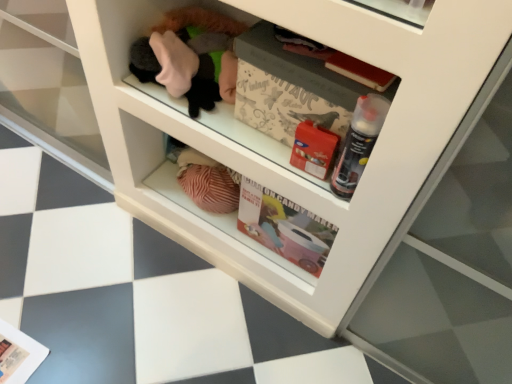
In order to face translucent plastic spray can at center right, should I rotate leftwards or rightwards?

A 13.614 degree turn to the right will do.

What do you see at coordinates (291, 88) in the screenshot? I see `white paper magazine at center, the 1th magazine in the right-to-left sequence` at bounding box center [291, 88].

Find the location of a particular element. Image resolution: width=512 pixels, height=384 pixels. translucent plastic spray can at center right is located at coordinates (358, 143).

From the picture: From a real-world perspective, is matte paper magazine at lower left, placed as the 1th magazine when sorted from bottom to top, physically located above or below white paper magazine at center, the 2th magazine when ordered from bottom to top?

matte paper magazine at lower left, placed as the 1th magazine when sorted from bottom to top, is situated lower than white paper magazine at center, the 2th magazine when ordered from bottom to top, in the real world.

Is matte paper magazine at lower left, placed as the 1th magazine when sorted from bottom to top, touching white paper magazine at center, which is the 2th magazine in left-to-right order?

They are not placed beside each other.

Is matte paper magazine at lower left, the first magazine positioned from the back, closer to the viewer compared to white paper magazine at center, placed as the 1th magazine when sorted from top to bottom?

That is False.

Considering the positions of point (22, 351) and point (348, 106), is point (22, 351) closer or farther from the camera than point (348, 106)?

Clearly, point (22, 351) is more distant from the camera than point (348, 106).

Are translucent plastic spray can at center right and white paper magazine at center, which is the 2th magazine in left-to-right order, located far from each other?

translucent plastic spray can at center right is actually quite close to white paper magazine at center, which is the 2th magazine in left-to-right order.

Is translucent plastic spray can at center right behind white paper magazine at center, the first magazine from the front?

No, translucent plastic spray can at center right is in front of white paper magazine at center, the first magazine from the front.

Can you confirm if translucent plastic spray can at center right is wider than white paper magazine at center, which is the 2th magazine in left-to-right order?

No.

From a real-world perspective, relative to white paper magazine at center, the 2th magazine when ordered from bottom to top, is translucent plastic spray can at center right vertically above or below?

In terms of real-world spatial position, translucent plastic spray can at center right is above white paper magazine at center, the 2th magazine when ordered from bottom to top.

From a real-world perspective, is matte paper magazine at lower left, which ranks as the first magazine in left-to-right order, under translucent plastic spray can at center right?

Yes, from a real-world perspective, matte paper magazine at lower left, which ranks as the first magazine in left-to-right order, is below translucent plastic spray can at center right.

How different are the orientations of matte paper magazine at lower left, acting as the second magazine starting from the right, and translucent plastic spray can at center right in degrees?

matte paper magazine at lower left, acting as the second magazine starting from the right, and translucent plastic spray can at center right are facing 10.9 degrees away from each other.

This screenshot has width=512, height=384. Identify the location of bottle that is in front of the matte paper magazine at lower left, placed as the 1th magazine when sorted from bottom to top. (358, 143).

Does matte paper magazine at lower left, which ranks as the first magazine in left-to-right order, have a lesser width compared to translucent plastic spray can at center right?

In fact, matte paper magazine at lower left, which ranks as the first magazine in left-to-right order, might be wider than translucent plastic spray can at center right.

What's the angular difference between white paper magazine at center, the 1th magazine in the right-to-left sequence, and translucent plastic spray can at center right's facing directions?

They differ by 5.11 degrees in their facing directions.

Is white paper magazine at center, placed as the 1th magazine when sorted from top to bottom, oriented away from translucent plastic spray can at center right?

That's not correct — white paper magazine at center, placed as the 1th magazine when sorted from top to bottom, is not looking away from translucent plastic spray can at center right.

In the scene shown: Does white paper magazine at center, the 1th magazine in the right-to-left sequence, have a lesser width compared to translucent plastic spray can at center right?

Incorrect, the width of white paper magazine at center, the 1th magazine in the right-to-left sequence, is not less than that of translucent plastic spray can at center right.

In terms of width, does white paper magazine at center, the 2th magazine when ordered from bottom to top, look wider or thinner when compared to matte paper magazine at lower left, acting as the second magazine starting from the right?

white paper magazine at center, the 2th magazine when ordered from bottom to top, is thinner than matte paper magazine at lower left, acting as the second magazine starting from the right.

Does white paper magazine at center, the first magazine from the front, have a lesser height compared to matte paper magazine at lower left, the second magazine when ordered from front to back?

No, white paper magazine at center, the first magazine from the front, is not shorter than matte paper magazine at lower left, the second magazine when ordered from front to back.

Is white paper magazine at center, the 1th magazine in the right-to-left sequence, next to matte paper magazine at lower left, the second magazine when ordered from front to back, and touching it?

white paper magazine at center, the 1th magazine in the right-to-left sequence, and matte paper magazine at lower left, the second magazine when ordered from front to back, are not in contact.

From the image's perspective, is white paper magazine at center, which is the 2th magazine in left-to-right order, under matte paper magazine at lower left, which appears as the second magazine when viewed from the top?

No, from the image's perspective, white paper magazine at center, which is the 2th magazine in left-to-right order, is not beneath matte paper magazine at lower left, which appears as the second magazine when viewed from the top.

From the image's perspective, is translucent plastic spray can at center right below matte paper magazine at lower left, the second magazine when ordered from front to back?

No, from the image's perspective, translucent plastic spray can at center right is not below matte paper magazine at lower left, the second magazine when ordered from front to back.

The width and height of the screenshot is (512, 384). I want to click on the 2nd magazine positioned below the translucent plastic spray can at center right (from a real-world perspective), so click(x=18, y=354).

Identify the location of magazine that appears on the right of matte paper magazine at lower left, which ranks as the first magazine in left-to-right order. Image resolution: width=512 pixels, height=384 pixels. (291, 88).

From a real-world perspective, starting from the translucent plastic spray can at center right, which magazine is the 1st one below it? Please provide its 2D coordinates.

[(291, 88)]

From the image, which object appears to be farther from translucent plastic spray can at center right, white paper magazine at center, positioned as the second magazine in back-to-front order, or matte paper magazine at lower left, acting as the second magazine starting from the right?

Based on the image, matte paper magazine at lower left, acting as the second magazine starting from the right, appears to be further to translucent plastic spray can at center right.

Based on their spatial positions, is white paper magazine at center, placed as the 1th magazine when sorted from top to bottom, or translucent plastic spray can at center right further from matte paper magazine at lower left, which appears as the second magazine when viewed from the top?

translucent plastic spray can at center right is further to matte paper magazine at lower left, which appears as the second magazine when viewed from the top.

In the scene shown: Based on their spatial positions, is translucent plastic spray can at center right or white paper magazine at center, the first magazine from the front, further from matte paper magazine at lower left, which appears as the second magazine when viewed from the top?

Based on the image, translucent plastic spray can at center right appears to be further to matte paper magazine at lower left, which appears as the second magazine when viewed from the top.

Looking at the image, which one is located further to translucent plastic spray can at center right, matte paper magazine at lower left, acting as the second magazine starting from the right, or white paper magazine at center, the 2th magazine when ordered from bottom to top?

matte paper magazine at lower left, acting as the second magazine starting from the right, lies further to translucent plastic spray can at center right than the other object.

Based on their spatial positions, is matte paper magazine at lower left, which appears as the second magazine when viewed from the top, or translucent plastic spray can at center right closer to white paper magazine at center, placed as the 1th magazine when sorted from top to bottom?

translucent plastic spray can at center right.

Estimate the real-world distances between objects in this image. Which object is further from white paper magazine at center, the 2th magazine when ordered from bottom to top, translucent plastic spray can at center right or matte paper magazine at lower left, placed as the 1th magazine when sorted from bottom to top?

matte paper magazine at lower left, placed as the 1th magazine when sorted from bottom to top.

Image resolution: width=512 pixels, height=384 pixels. What are the coordinates of `magazine between matte paper magazine at lower left, the first magazine positioned from the back, and translucent plastic spray can at center right` in the screenshot? It's located at (291, 88).